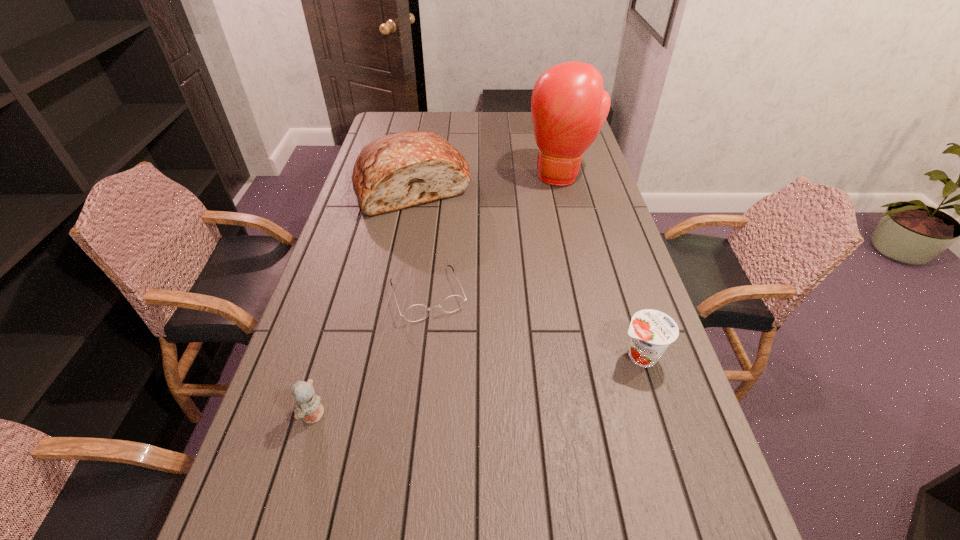
I want to click on free space between the third farthest object and the yogurt, so click(534, 325).

This screenshot has height=540, width=960. What are the coordinates of `empty space that is in between the tallest object and the fourth farthest object` in the screenshot? It's located at (601, 266).

At what (x,y) coordinates should I click in order to perform the action: click on unoccupied area between the boxing glove and the fourth shortest object. Please return your answer as a coordinate pair (x, y). Looking at the image, I should click on (488, 181).

Where is `free point between the teddy bear and the boxing glove`? This screenshot has height=540, width=960. free point between the teddy bear and the boxing glove is located at coordinates (438, 295).

Identify the location of free space between the yogurt and the bread. (526, 271).

The height and width of the screenshot is (540, 960). In order to click on object that is the closest to the bread in this screenshot , I will do `click(569, 106)`.

You are a GUI agent. You are given a task and a screenshot of the screen. Output one action in this format:
    pyautogui.click(x=<x>, y=<y>)
    Task: Click on the object identified as the second closest to the nearest object
    The width and height of the screenshot is (960, 540).
    Given the screenshot: What is the action you would take?
    pyautogui.click(x=395, y=171)

This screenshot has height=540, width=960. Find the location of `vacant space that satisfies the following two spatial constraints: 1. on the back side of the second tallest object; 2. on the right side of the boxing glove`. vacant space that satisfies the following two spatial constraints: 1. on the back side of the second tallest object; 2. on the right side of the boxing glove is located at coordinates (415, 176).

Where is `vacant space that satisfies the following two spatial constraints: 1. on the back side of the spectacles; 2. on the right side of the boxing glove`? The height and width of the screenshot is (540, 960). vacant space that satisfies the following two spatial constraints: 1. on the back side of the spectacles; 2. on the right side of the boxing glove is located at coordinates (442, 176).

What are the coordinates of `vacant position in the image that satisfies the following two spatial constraints: 1. on the back side of the tallest object; 2. on the right side of the shortest object` in the screenshot? It's located at (442, 176).